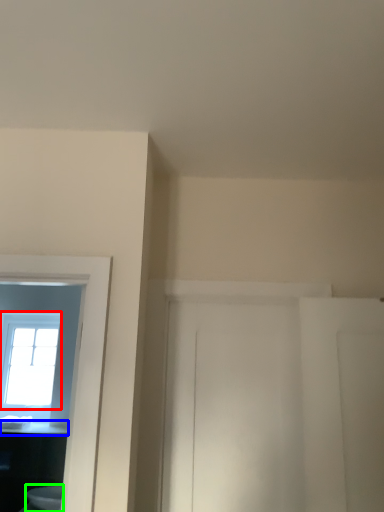
Question: Estimate the real-world distances between objects in this image. Which object is closer to window (highlighted by a red box), counter top (highlighted by a blue box) or toilet (highlighted by a green box)?

Choices:
 (A) counter top
 (B) toilet

Answer: (A)